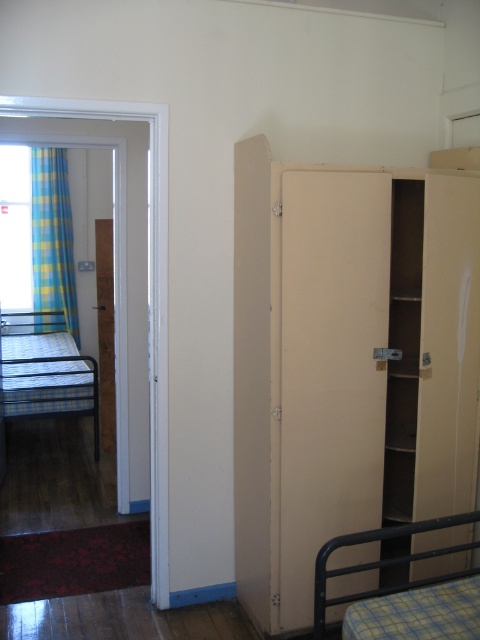
Based on the photo, you are moving into this room and need to place a large rectangular box that measures 1.2 meters in length. The box must be placed either on the beige matte cabinet at right or the metallic blue plaid bed at left. Based on their sizes, which object can accommodate the box without it hanging over the edges?

The metallic blue plaid bed at left is larger than the beige matte cabinet at right. Since the box is 1.2 meters long, it would fit better on the metallic blue plaid bed at left which has more surface area to accommodate the box without overhanging.

You are moving into this room and need to place a 5 meter long sofa between the blue plaid fabric at left and the plaid fabric bunk bed at lower right. Will the sofa fit in the space between them?

The distance between the blue plaid fabric at left and the plaid fabric bunk bed at lower right is 4.75 meters. Since the sofa is 5 meters long, it will not fit in the space between them as the available space is shorter than the sofa.

From the picture: You are standing in the center of the room and want to move towards the blue plaid fabric at left. In which direction should you walk?

The blue plaid fabric at left is located at point (52, 236), so you should walk towards the left side of the room to reach it.